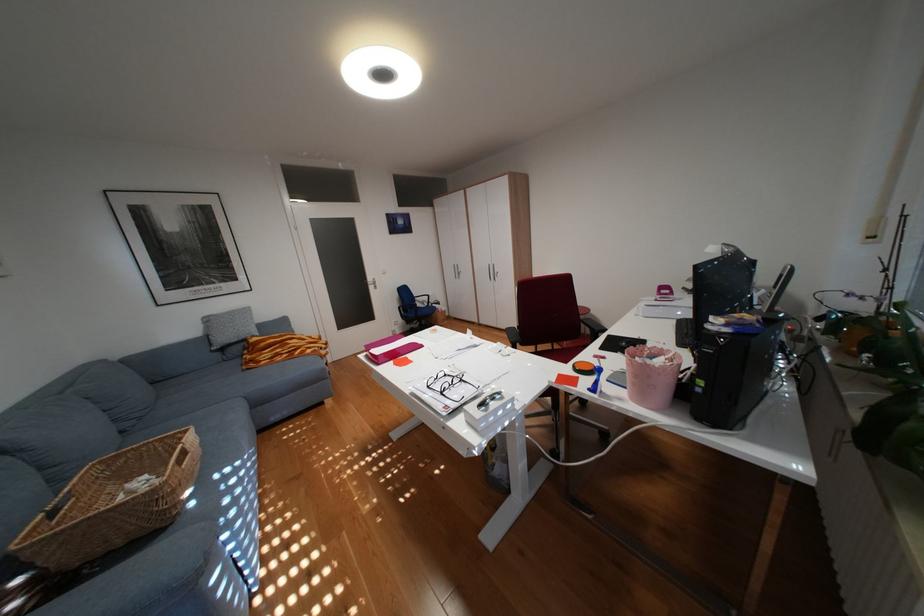
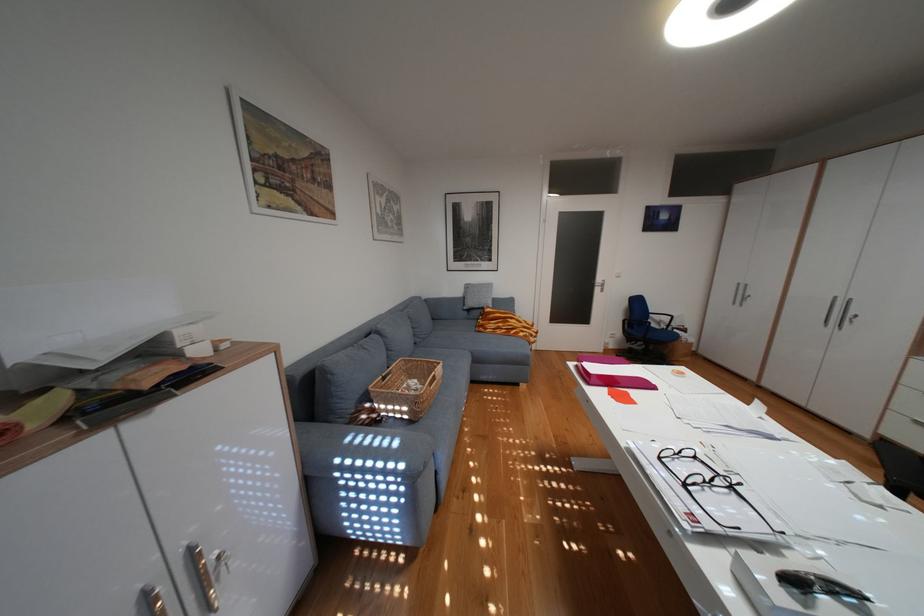
Question: The first image is from the beginning of the video and the second image is from the end. How did the camera likely rotate when shooting the video?

Choices:
 (A) Left
 (B) Right
 (C) Up
 (D) Down

Answer: (A)